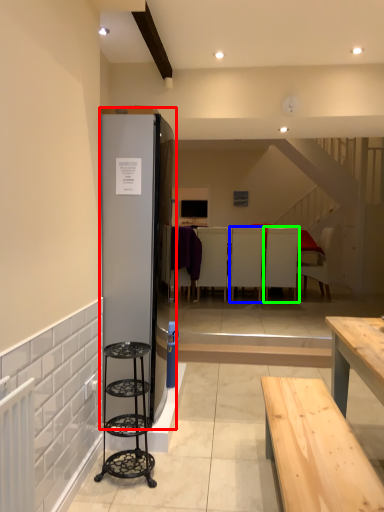
Question: Based on their relative distances, which object is nearer to fridge (highlighted by a red box)? Choose from armchair (highlighted by a blue box) and armchair (highlighted by a green box).

Choices:
 (A) armchair
 (B) armchair

Answer: (A)